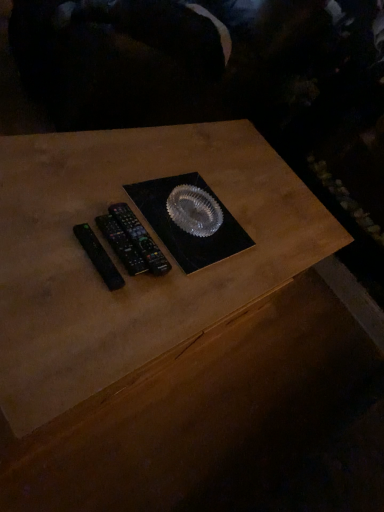
You are a GUI agent. You are given a task and a screenshot of the screen. Output one action in this format:
    pyautogui.click(x=<x>, y=<y>)
    Task: Click on the free region on the left part of black plastic remote controls at center, acting as the 3th control starting from the front
    The height and width of the screenshot is (512, 384).
    Given the screenshot: What is the action you would take?
    pyautogui.click(x=68, y=193)